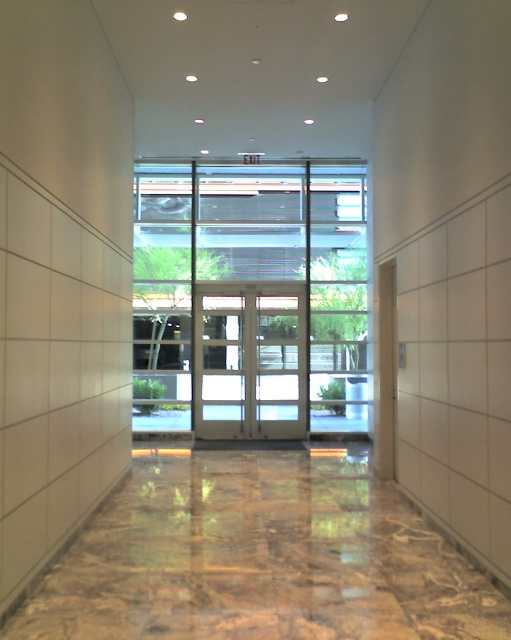
You are standing in the hallway and want to exit through the clear glass doors at center. Based on the coordinates provided, are you facing the correct direction to reach them?

Yes, the clear glass doors at center are located at coordinates point (251, 296), which is directly ahead in the hallway. Since you are facing the doors, you are facing the correct direction to reach them.

You are a delivery person carrying a large package that is 24 inches wide. You need to exit through the doors at the end of the hallway. Can you fit through the space between the white glass door at center and the matte glass door at center?

The white glass door at center and the matte glass door at center are 22.52 inches apart, which is narrower than your 24 inches wide package. Therefore, the package cannot fit through the space between them.

You are standing in the hallway and need to exit through the doors. Which door should you go through, the white glass doors at center or the white glass door at center?

You should go through the white glass door at center because the white glass doors at center is above it and likely part of the same exit structure.